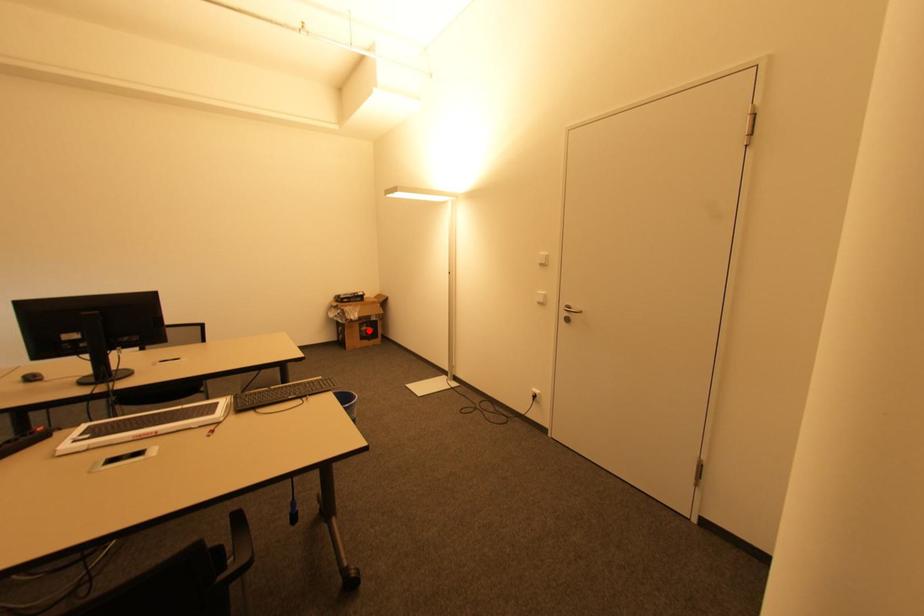
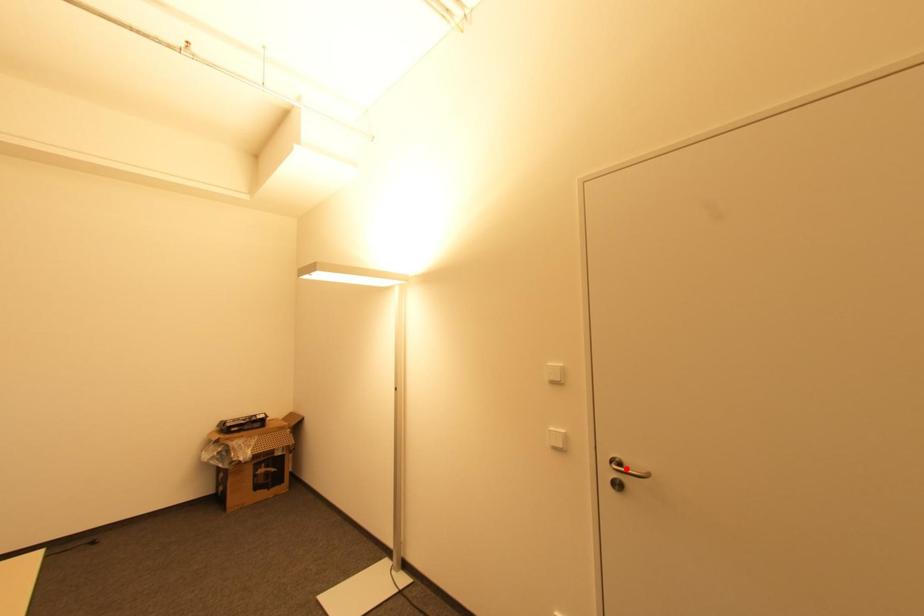
I am providing you with two images of the same scene from different viewpoints. A red point is marked on the first image and another point is marked on the second image. Are the points marked in image1 and image2 representing the same 3D position?

No